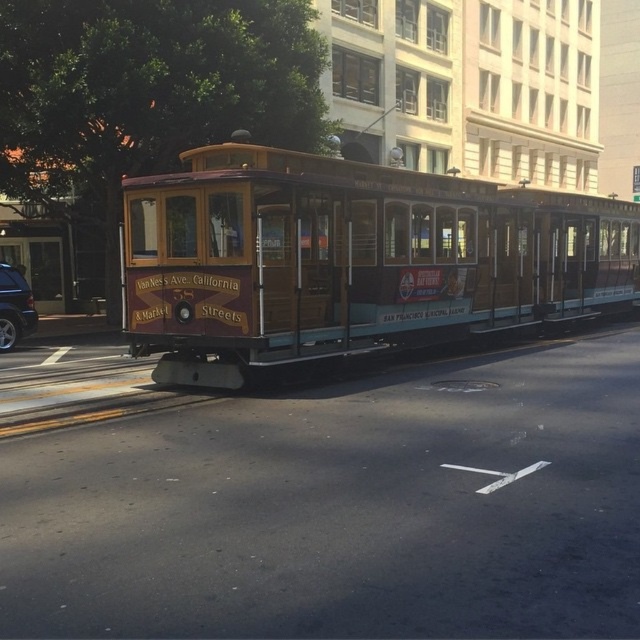
The height and width of the screenshot is (640, 640). What do you see at coordinates (349, 260) in the screenshot?
I see `wooden cable car at center` at bounding box center [349, 260].

Is wooden cable car at center bigger than shiny black suv at left?

Indeed, wooden cable car at center has a larger size compared to shiny black suv at left.

Image resolution: width=640 pixels, height=640 pixels. Describe the element at coordinates (349, 260) in the screenshot. I see `wooden cable car at center` at that location.

The height and width of the screenshot is (640, 640). In order to click on wooden cable car at center in this screenshot , I will do [x=349, y=260].